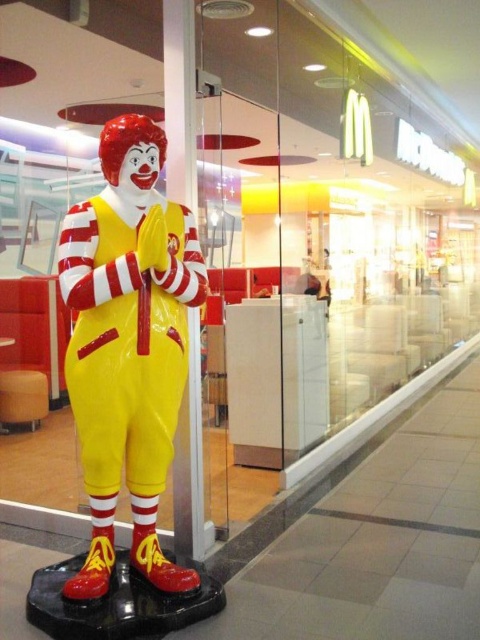
Question: From the image, what is the correct spatial relationship of shiny plastic clown at center in relation to wooden stool at lower left?

Choices:
 (A) above
 (B) below

Answer: (A)

Question: Which point appears closest to the camera in this image?

Choices:
 (A) (145, 458)
 (B) (39, 400)

Answer: (A)

Question: Is shiny plastic clown at center below wooden stool at lower left?

Choices:
 (A) yes
 (B) no

Answer: (B)

Question: Does shiny plastic clown at center come in front of wooden stool at lower left?

Choices:
 (A) no
 (B) yes

Answer: (B)

Question: Among these points, which one is farthest from the camera?

Choices:
 (A) (97, 561)
 (B) (12, 387)

Answer: (B)

Question: Which of the following is the farthest from the observer?

Choices:
 (A) shiny plastic clown at center
 (B) wooden stool at lower left

Answer: (B)